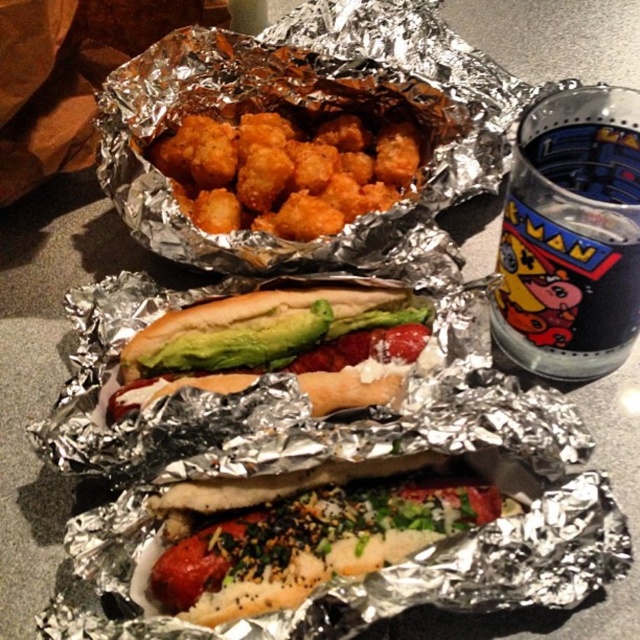
Does point (253, 502) lie behind point (392, 387)?

No.

Can you confirm if sesame seed bun hot dog at center is bigger than green avocado hot dog at center?

Incorrect, sesame seed bun hot dog at center is not larger than green avocado hot dog at center.

What do you see at coordinates (308, 541) in the screenshot? I see `sesame seed bun hot dog at center` at bounding box center [308, 541].

This screenshot has height=640, width=640. What are the coordinates of `sesame seed bun hot dog at center` in the screenshot? It's located at (308, 541).

Is sesame seed bun hot dog at center to the left of golden crispy tater tots at center from the viewer's perspective?

No, sesame seed bun hot dog at center is not to the left of golden crispy tater tots at center.

Who is more forward, (282, 524) or (276, 186)?

Point (282, 524) is in front.

The image size is (640, 640). In order to click on sesame seed bun hot dog at center in this screenshot , I will do `click(308, 541)`.

Find the location of a particular element. The width and height of the screenshot is (640, 640). sesame seed bun hot dog at center is located at coordinates (308, 541).

Between green avocado hot dog at center and golden crispy tater tots at center, which one appears on the right side from the viewer's perspective?

From the viewer's perspective, green avocado hot dog at center appears more on the right side.

Does green avocado hot dog at center have a smaller size compared to golden crispy tater tots at center?

Correct, green avocado hot dog at center occupies less space than golden crispy tater tots at center.

Is point (337, 336) closer to camera compared to point (324, 189)?

Yes.

Where is `green avocado hot dog at center`? green avocado hot dog at center is located at coordinates (275, 346).